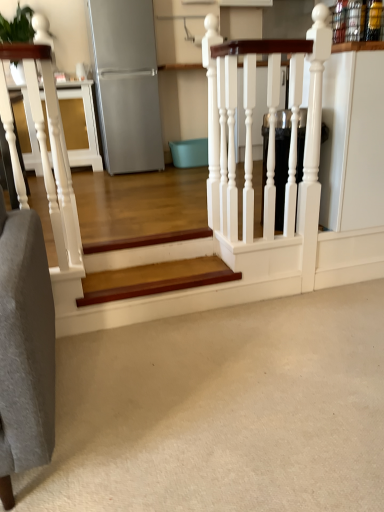
Question: Is white carpet at lower center facing towards satin silver refrigerator at upper left?

Choices:
 (A) no
 (B) yes

Answer: (A)

Question: Can you confirm if white carpet at lower center is taller than satin silver refrigerator at upper left?

Choices:
 (A) yes
 (B) no

Answer: (B)

Question: Would you say satin silver refrigerator at upper left is part of white carpet at lower center's contents?

Choices:
 (A) yes
 (B) no

Answer: (B)

Question: Is white carpet at lower center in contact with satin silver refrigerator at upper left?

Choices:
 (A) yes
 (B) no

Answer: (B)

Question: Considering the relative positions of white carpet at lower center and satin silver refrigerator at upper left in the image provided, is white carpet at lower center in front of satin silver refrigerator at upper left?

Choices:
 (A) yes
 (B) no

Answer: (A)

Question: From a real-world perspective, is white carpet at lower center located beneath satin silver refrigerator at upper left?

Choices:
 (A) yes
 (B) no

Answer: (A)

Question: Is white glossy rail at upper center beside wooden stair at center?

Choices:
 (A) yes
 (B) no

Answer: (B)

Question: Is white glossy rail at upper center far from wooden stair at center?

Choices:
 (A) yes
 (B) no

Answer: (B)

Question: Does white glossy rail at upper center have a greater width compared to wooden stair at center?

Choices:
 (A) no
 (B) yes

Answer: (A)

Question: Considering the relative positions of white glossy rail at upper center and wooden stair at center in the image provided, is white glossy rail at upper center to the left of wooden stair at center from the viewer's perspective?

Choices:
 (A) yes
 (B) no

Answer: (B)

Question: Would you say white glossy rail at upper center is outside wooden stair at center?

Choices:
 (A) yes
 (B) no

Answer: (A)

Question: From the image's perspective, is white glossy rail at upper center below wooden stair at center?

Choices:
 (A) no
 (B) yes

Answer: (A)

Question: Can you confirm if satin silver refrigerator at upper left is bigger than white carpet at lower center?

Choices:
 (A) no
 (B) yes

Answer: (B)